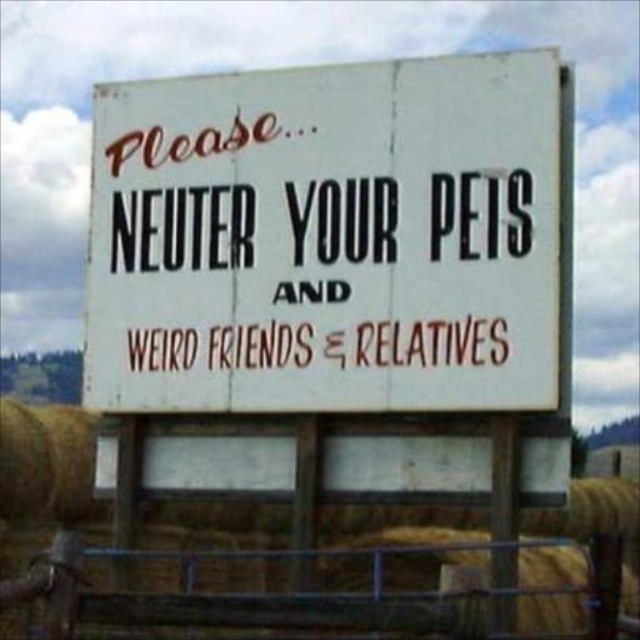
Question: Does white paper sign at center come behind metal wire fence at lower center?

Choices:
 (A) no
 (B) yes

Answer: (B)

Question: Is white paper sign at center in front of metal wire fence at lower center?

Choices:
 (A) no
 (B) yes

Answer: (A)

Question: Among these objects, which one is nearest to the camera?

Choices:
 (A) metal wire fence at lower center
 (B) white paper sign at center

Answer: (A)

Question: Does white paper sign at center appear on the left side of metal wire fence at lower center?

Choices:
 (A) no
 (B) yes

Answer: (A)